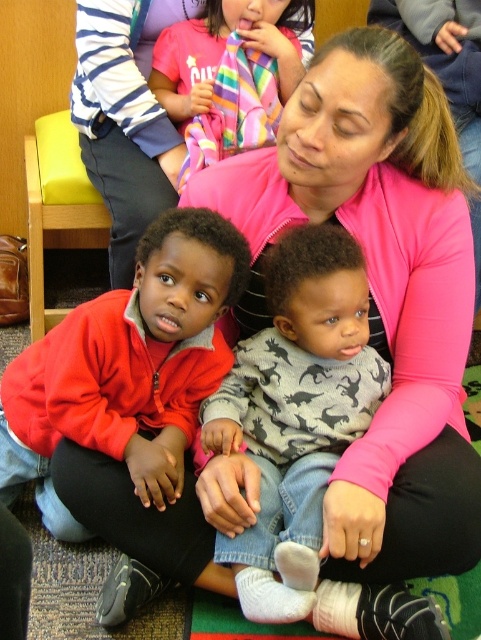
You are a photographer adjusting your camera to focus on two specific points in the image. The first point is at coordinates point [250,381] and the second point is at coordinates point [118,60]. Which point should you focus on first if you want to capture the closest object to the camera?

Point [250,381] is closer to the camera than point [118,60], so you should focus on point [250,381] first to capture the closest object.